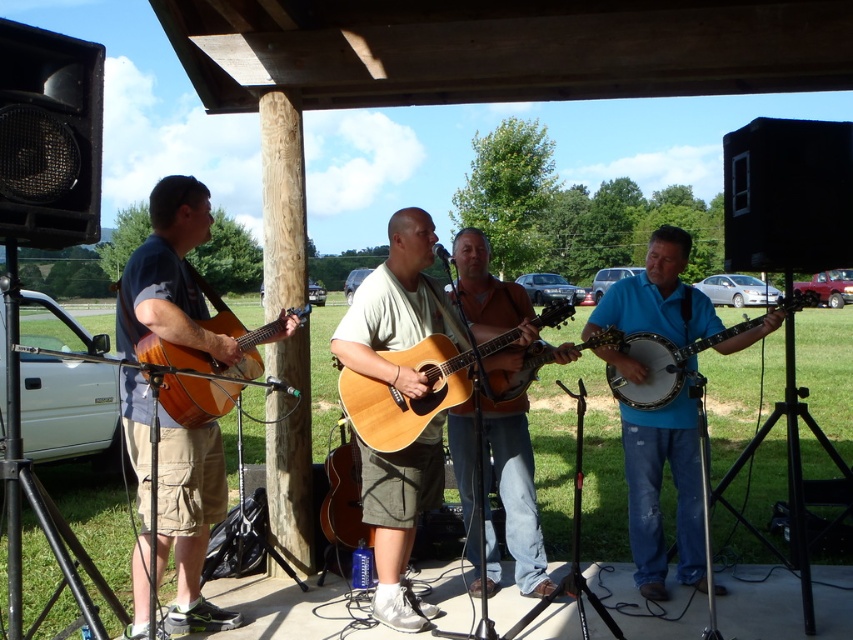
You are a photographer trying to capture the performer at point (213,481) and the one at point (187,387) in the same frame. Since you want to ensure both are in focus, which performer should you focus on first to make sure they are sharp?

You should focus on the performer at point (213,481) first because it is closer to you than the performer at point (187,387), ensuring both will be in focus if you set the focus on the closer one.

From the picture: You are a photographer setting up for a live music session. You need to ensure that the brown wood banjo at center and the light wood acoustic guitar at center are both visible in your shot. Given their sizes, which instrument should you focus on first to frame the shot properly?

The brown wood banjo at center is larger than the light wood acoustic guitar at center, so you should focus on framing the brown wood banjo at center first to ensure it fits well in the shot.